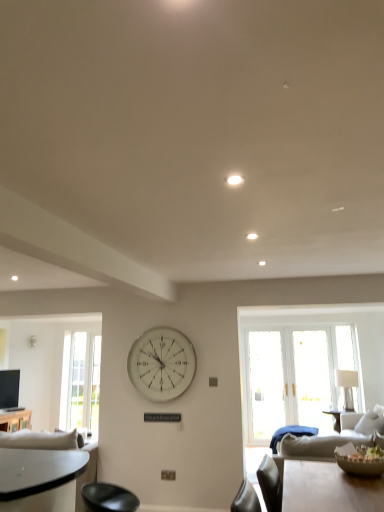
Question: Does white fabric lampshade at right have a smaller size compared to clear glass door at left?

Choices:
 (A) no
 (B) yes

Answer: (A)

Question: Is white fabric lampshade at right facing away from clear glass door at left?

Choices:
 (A) yes
 (B) no

Answer: (B)

Question: Can you confirm if white fabric lampshade at right is taller than clear glass door at left?

Choices:
 (A) yes
 (B) no

Answer: (B)

Question: Is white fabric lampshade at right wider than clear glass door at left?

Choices:
 (A) no
 (B) yes

Answer: (B)

Question: Is white fabric lampshade at right closer to the viewer compared to clear glass door at left?

Choices:
 (A) no
 (B) yes

Answer: (B)

Question: From the image's perspective, is wooden table at lower left above or below white fabric couch at lower left?

Choices:
 (A) above
 (B) below

Answer: (B)

Question: Is wooden table at lower left inside the boundaries of white fabric couch at lower left, or outside?

Choices:
 (A) inside
 (B) outside

Answer: (B)

Question: Considering the positions of wooden table at lower left and white fabric couch at lower left in the image, is wooden table at lower left wider or thinner than white fabric couch at lower left?

Choices:
 (A) thin
 (B) wide

Answer: (A)

Question: Visually, is wooden table at lower left positioned to the left or to the right of white fabric couch at lower left?

Choices:
 (A) left
 (B) right

Answer: (A)

Question: Is white fabric lampshade at right bigger or smaller than white glossy light at upper center?

Choices:
 (A) small
 (B) big

Answer: (B)

Question: Is white fabric lampshade at right taller or shorter than white glossy light at upper center?

Choices:
 (A) short
 (B) tall

Answer: (B)

Question: In terms of width, does white fabric lampshade at right look wider or thinner when compared to white glossy light at upper center?

Choices:
 (A) thin
 (B) wide

Answer: (B)

Question: Considering the relative positions of white fabric lampshade at right and white glossy light at upper center in the image provided, is white fabric lampshade at right to the left or to the right of white glossy light at upper center?

Choices:
 (A) left
 (B) right

Answer: (B)

Question: Is clear glass door at left inside or outside of wooden table at lower left?

Choices:
 (A) outside
 (B) inside

Answer: (A)

Question: In terms of width, does clear glass door at left look wider or thinner when compared to wooden table at lower left?

Choices:
 (A) thin
 (B) wide

Answer: (A)